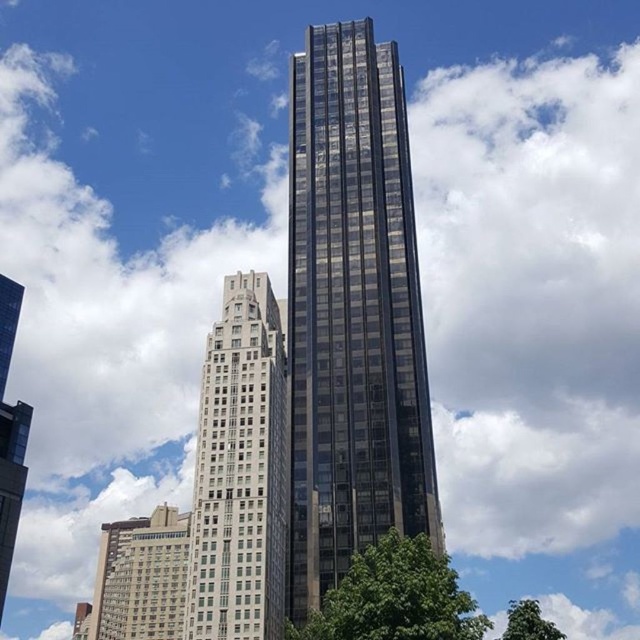
You are a city planner reviewing the urban layout. You need to determine the spatial relationship between the glassy black skyscraper at center and the white stone building at center. Which one is located to the right of the other?

The glassy black skyscraper at center is positioned on the right side of white stone building at center, so it is located to the right of the white stone building at center.

You are standing in the city park and looking at the white stone building at center and the green leafy tree at lower center. Which object is closer to you?

The green leafy tree at lower center is behind the white stone building at center, so the white stone building at center is closer to you.